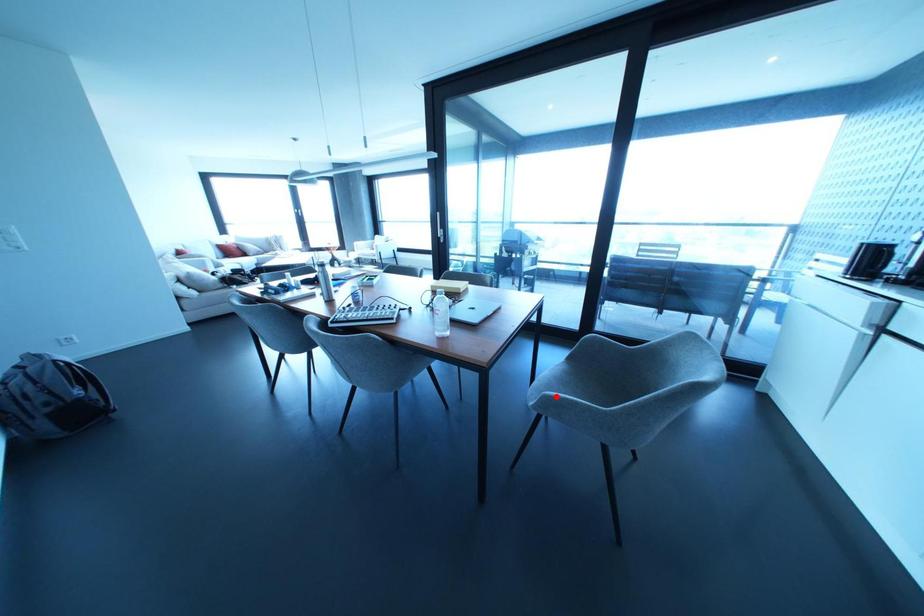
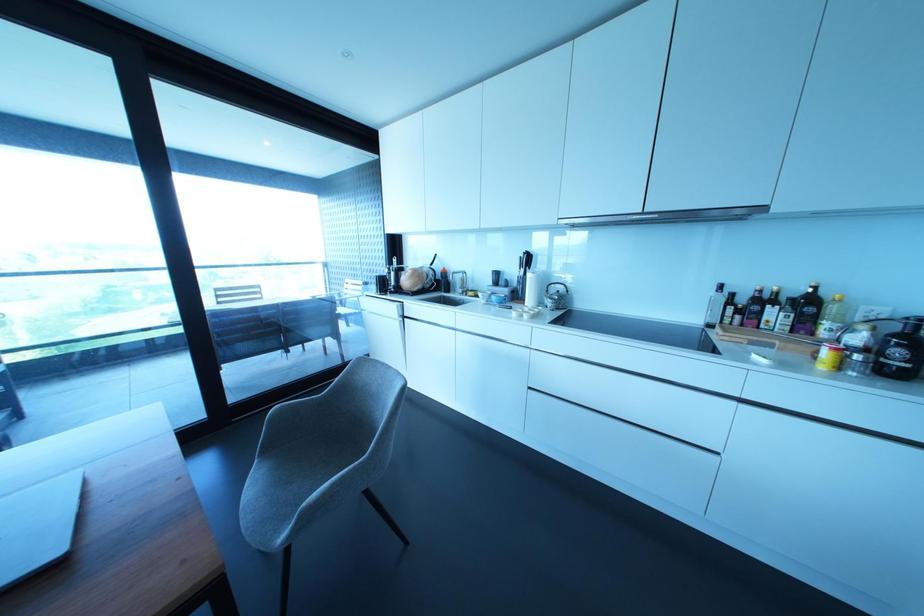
Question: I am providing you with two images of the same scene from different viewpoints. In image1, a red point is highlighted. Considering the same 3D point in image2, which of the following is correct?

Choices:
 (A) It is closer
 (B) It is farther

Answer: (B)